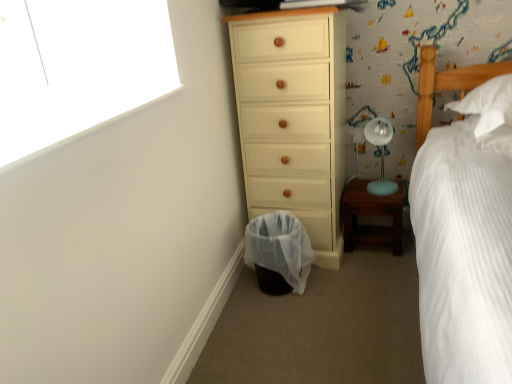
Question: Considering the relative positions of wooden nightstand at lower right and translucent plastic laundry basket at lower center in the image provided, is wooden nightstand at lower right to the left of translucent plastic laundry basket at lower center from the viewer's perspective?

Choices:
 (A) no
 (B) yes

Answer: (A)

Question: Can you confirm if wooden nightstand at lower right is bigger than translucent plastic laundry basket at lower center?

Choices:
 (A) no
 (B) yes

Answer: (A)

Question: Does wooden nightstand at lower right have a lesser height compared to translucent plastic laundry basket at lower center?

Choices:
 (A) yes
 (B) no

Answer: (A)

Question: Considering the relative sizes of wooden nightstand at lower right and translucent plastic laundry basket at lower center in the image provided, is wooden nightstand at lower right thinner than translucent plastic laundry basket at lower center?

Choices:
 (A) yes
 (B) no

Answer: (A)

Question: From a real-world perspective, is wooden nightstand at lower right physically below translucent plastic laundry basket at lower center?

Choices:
 (A) no
 (B) yes

Answer: (B)

Question: Would you say matte cream chest of drawers at center is to the left or to the right of light blue plastic table lamp at right in the picture?

Choices:
 (A) left
 (B) right

Answer: (A)

Question: From the image's perspective, is matte cream chest of drawers at center located above or below light blue plastic table lamp at right?

Choices:
 (A) below
 (B) above

Answer: (B)

Question: Based on their sizes in the image, would you say matte cream chest of drawers at center is bigger or smaller than light blue plastic table lamp at right?

Choices:
 (A) small
 (B) big

Answer: (B)

Question: Considering their positions, is matte cream chest of drawers at center located in front of or behind light blue plastic table lamp at right?

Choices:
 (A) front
 (B) behind

Answer: (A)

Question: Would you say translucent plastic laundry basket at lower center is inside or outside light blue plastic table lamp at right?

Choices:
 (A) inside
 (B) outside

Answer: (B)

Question: Is translucent plastic laundry basket at lower center wider or thinner than light blue plastic table lamp at right?

Choices:
 (A) thin
 (B) wide

Answer: (B)

Question: In the image, is translucent plastic laundry basket at lower center on the left side or the right side of light blue plastic table lamp at right?

Choices:
 (A) left
 (B) right

Answer: (A)

Question: From a real-world perspective, is translucent plastic laundry basket at lower center physically located above or below light blue plastic table lamp at right?

Choices:
 (A) above
 (B) below

Answer: (B)

Question: From the image's perspective, is wooden nightstand at lower right located above or below translucent plastic laundry basket at lower center?

Choices:
 (A) below
 (B) above

Answer: (B)

Question: Considering the positions of wooden nightstand at lower right and translucent plastic laundry basket at lower center in the image, is wooden nightstand at lower right bigger or smaller than translucent plastic laundry basket at lower center?

Choices:
 (A) small
 (B) big

Answer: (A)